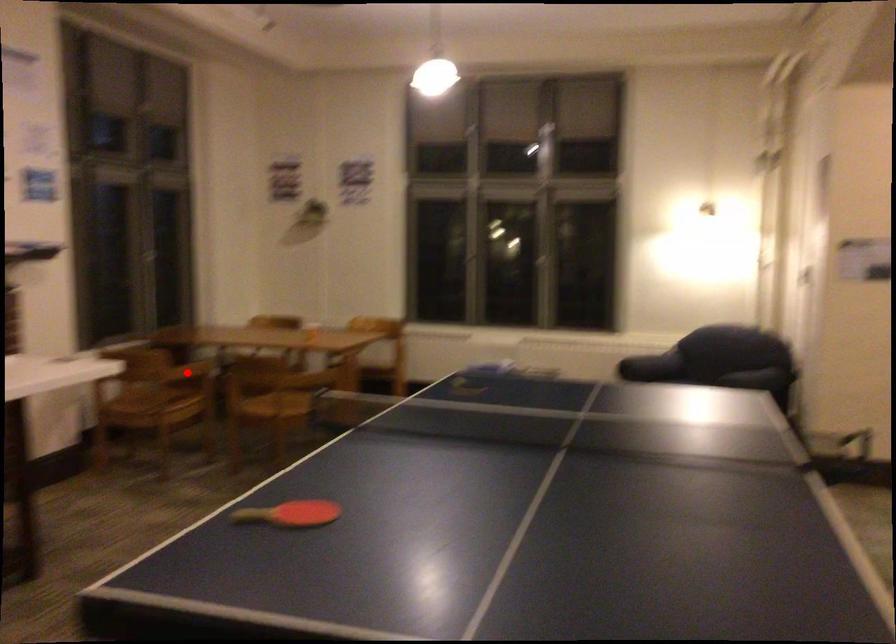
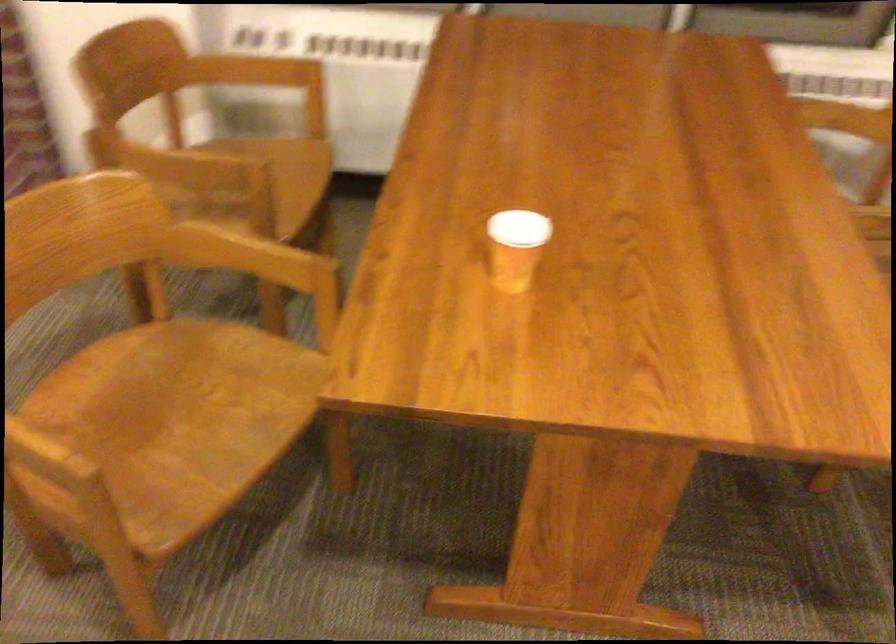
Question: I am providing you with two images of the same scene from different viewpoints. A red point is marked on the first image. At the location where the point appears in image 1, is it still visible in image 2?

Choices:
 (A) Yes
 (B) No

Answer: (A)